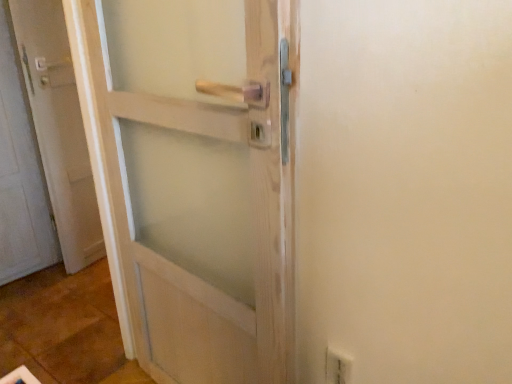
Question: From the image's perspective, relative to white matte door at left, is white plastic electric outlet at lower right above or below?

Choices:
 (A) above
 (B) below

Answer: (B)

Question: From a real-world perspective, relative to white matte door at left, is white plastic electric outlet at lower right vertically above or below?

Choices:
 (A) below
 (B) above

Answer: (A)

Question: Relative to white matte door at left, is white plastic electric outlet at lower right in front or behind?

Choices:
 (A) front
 (B) behind

Answer: (A)

Question: Is white matte door at left wider or thinner than white plastic electric outlet at lower right?

Choices:
 (A) thin
 (B) wide

Answer: (B)

Question: Is white matte door at left in front of or behind white plastic electric outlet at lower right in the image?

Choices:
 (A) front
 (B) behind

Answer: (B)

Question: From the image's perspective, is white matte door at left located above or below white plastic electric outlet at lower right?

Choices:
 (A) above
 (B) below

Answer: (A)

Question: Would you say white matte door at left is inside or outside white plastic electric outlet at lower right?

Choices:
 (A) inside
 (B) outside

Answer: (B)